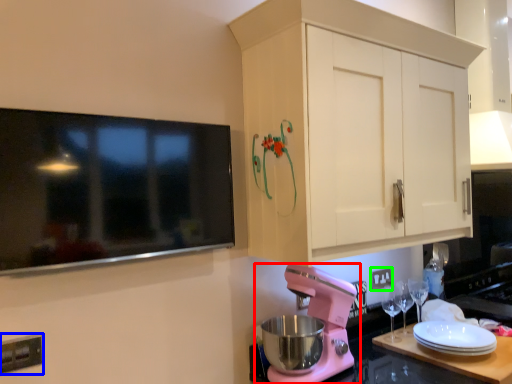
Question: Estimate the real-world distances between objects in this image. Which object is closer to mixer (highlighted by a red box), electric outlet (highlighted by a blue box) or electric outlet (highlighted by a green box)?

Choices:
 (A) electric outlet
 (B) electric outlet

Answer: (B)